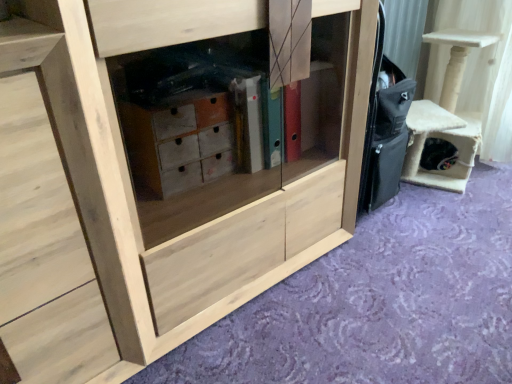
At what (x,y) coordinates should I click in order to perform the action: click on natural wood cabinet at center. Please return your answer as a coordinate pair (x, y). Looking at the image, I should click on (164, 172).

What do you see at coordinates (60, 205) in the screenshot? The height and width of the screenshot is (384, 512). I see `natural wood cabinet at lower left` at bounding box center [60, 205].

Identify the location of beige felt cat house at right. The height and width of the screenshot is (384, 512). (446, 116).

Is natural wood cabinet at lower left situated inside natural wood cabinet at center or outside?

natural wood cabinet at lower left cannot be found inside natural wood cabinet at center.

Based on the photo, which is more to the right, natural wood cabinet at lower left or natural wood cabinet at center?

Positioned to the right is natural wood cabinet at center.

Based on the photo, what's the angular difference between natural wood cabinet at lower left and natural wood cabinet at center's facing directions?

The angle between the facing direction of natural wood cabinet at lower left and the facing direction of natural wood cabinet at center is 2.73e-05 degrees.

Is point (25, 269) more distant than point (121, 356)?

No.

Is natural wood cabinet at center shorter than beige felt cat house at right?

No, natural wood cabinet at center is not shorter than beige felt cat house at right.

Looking at this image, can you confirm if natural wood cabinet at center is bigger than beige felt cat house at right?

Indeed, natural wood cabinet at center has a larger size compared to beige felt cat house at right.

Can we say natural wood cabinet at center lies outside beige felt cat house at right?

natural wood cabinet at center is positioned outside beige felt cat house at right.

Is natural wood cabinet at center in front of or behind beige felt cat house at right in the image?

In the image, natural wood cabinet at center appears in front of beige felt cat house at right.

Considering the relative sizes of beige felt cat house at right and natural wood cabinet at center in the image provided, is beige felt cat house at right smaller than natural wood cabinet at center?

Correct, beige felt cat house at right occupies less space than natural wood cabinet at center.

Is beige felt cat house at right touching natural wood cabinet at center?

beige felt cat house at right and natural wood cabinet at center are not in contact.

Is the position of beige felt cat house at right less distant than that of natural wood cabinet at center?

No, beige felt cat house at right is further to the viewer.

Find the location of a particular element. furniture located on the right of natural wood cabinet at center is located at coordinates (446, 116).

Who is bigger, natural wood cabinet at lower left or beige felt cat house at right?

With larger size is beige felt cat house at right.

At what (x,y) coordinates should I click in order to perform the action: click on chest of drawers in front of the beige felt cat house at right. Please return your answer as a coordinate pair (x, y). The image size is (512, 384). Looking at the image, I should click on (60, 205).

Who is shorter, natural wood cabinet at lower left or beige felt cat house at right?

Standing shorter between the two is beige felt cat house at right.

From the image's perspective, is natural wood cabinet at center on natural wood cabinet at lower left?

Correct, natural wood cabinet at center appears higher than natural wood cabinet at lower left in the image.

How different are the orientations of natural wood cabinet at center and natural wood cabinet at lower left in degrees?

They differ by 2.73e-05 degrees in their facing directions.

Can you see natural wood cabinet at center touching natural wood cabinet at lower left?

No.

Visually, is natural wood cabinet at center positioned to the left or to the right of natural wood cabinet at lower left?

Based on their positions, natural wood cabinet at center is located to the right of natural wood cabinet at lower left.

How many degrees apart are the facing directions of beige felt cat house at right and natural wood cabinet at lower left?

4.77 degrees.

From a real-world perspective, is beige felt cat house at right on natural wood cabinet at lower left?

No.

Between point (451, 115) and point (65, 341), which one is positioned behind?

Point (451, 115)

Which object is more forward, beige felt cat house at right or natural wood cabinet at lower left?

natural wood cabinet at lower left is more forward.

Identify the location of cabinetry on the right of the natural wood cabinet at lower left. click(x=164, y=172).

Locate an element on the screen. cabinetry below the beige felt cat house at right (from the image's perspective) is located at coordinates (164, 172).

From the picture: Considering their positions, is natural wood cabinet at lower left positioned further to natural wood cabinet at center than beige felt cat house at right?

Among the two, beige felt cat house at right is located further to natural wood cabinet at center.

Based on their spatial positions, is natural wood cabinet at center or beige felt cat house at right further from natural wood cabinet at lower left?

Among the two, beige felt cat house at right is located further to natural wood cabinet at lower left.

Estimate the real-world distances between objects in this image. Which object is closer to beige felt cat house at right, natural wood cabinet at lower left or natural wood cabinet at center?

natural wood cabinet at center is closer to beige felt cat house at right.

Based on the photo, from the image, which object appears to be farther from natural wood cabinet at center, beige felt cat house at right or natural wood cabinet at lower left?

Based on the image, beige felt cat house at right appears to be further to natural wood cabinet at center.

When comparing their distances from beige felt cat house at right, does natural wood cabinet at center or natural wood cabinet at lower left seem further?

Among the two, natural wood cabinet at lower left is located further to beige felt cat house at right.

Based on their spatial positions, is beige felt cat house at right or natural wood cabinet at center closer to natural wood cabinet at lower left?

natural wood cabinet at center is closer to natural wood cabinet at lower left.

The width and height of the screenshot is (512, 384). What are the coordinates of `cabinetry between natural wood cabinet at lower left and beige felt cat house at right from left to right` in the screenshot? It's located at (164, 172).